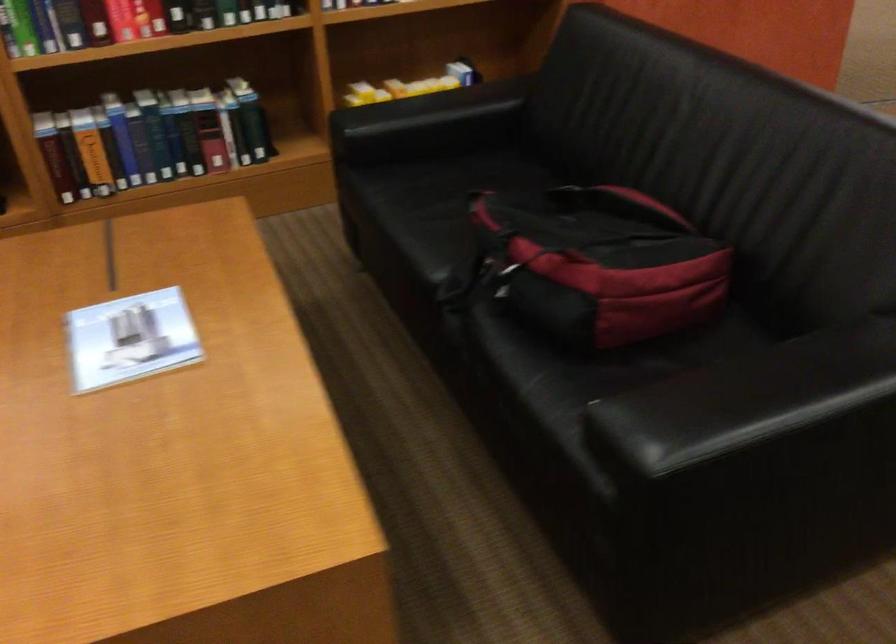
What are the coordinates of `black sofa armrest` in the screenshot? It's located at (745, 399).